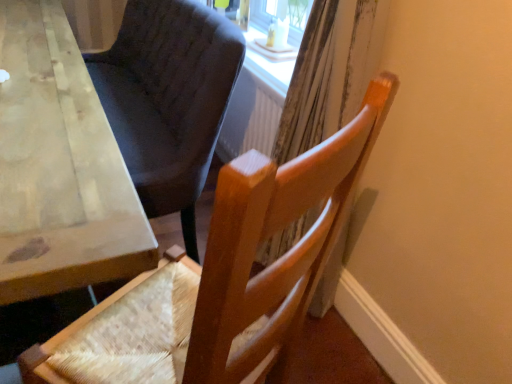
Where is `free space above wooden table at left (from a real-world perspective)`? free space above wooden table at left (from a real-world perspective) is located at coordinates (27, 57).